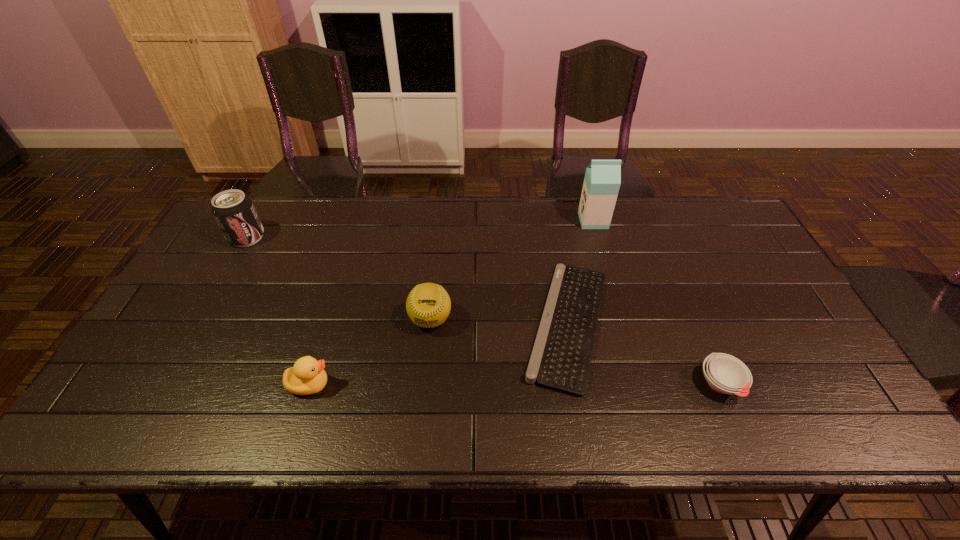
Find the location of a particular element. The height and width of the screenshot is (540, 960). blank area in the image that satisfies the following two spatial constraints: 1. on the back side of the tallest object; 2. on the left side of the second tallest object is located at coordinates (256, 221).

This screenshot has width=960, height=540. In order to click on vacant space that satisfies the following two spatial constraints: 1. on the logo side of the third tallest object; 2. on the left side of the soup bowl in this screenshot , I will do `click(424, 384)`.

Locate an element on the screen. This screenshot has height=540, width=960. vacant region that satisfies the following two spatial constraints: 1. on the logo side of the fourth object from right to left; 2. at the beak of the fourth tallest object is located at coordinates (423, 384).